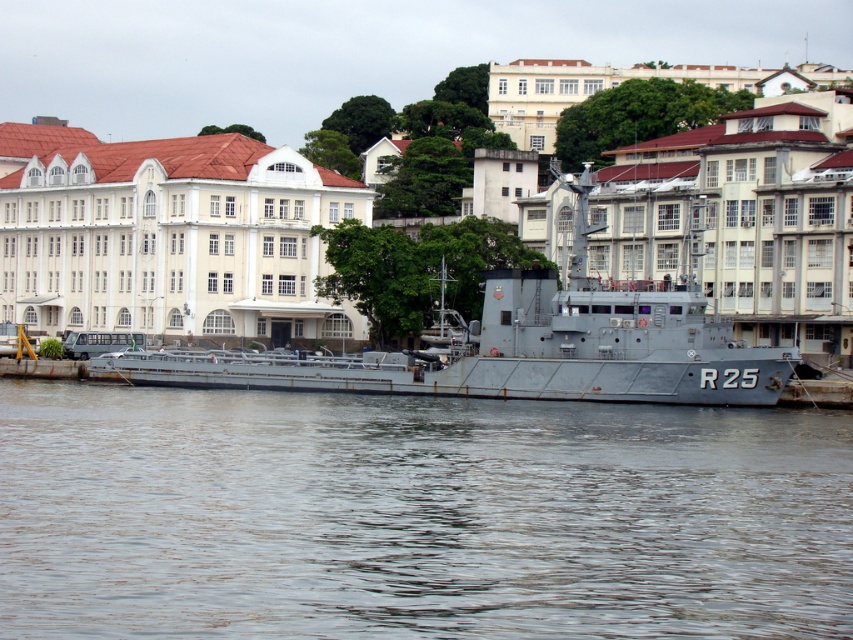
Can you confirm if brown water at lower center is positioned to the right of gray metallic ship at center?

In fact, brown water at lower center is to the left of gray metallic ship at center.

Does brown water at lower center lie in front of gray metallic ship at center?

That is True.

Image resolution: width=853 pixels, height=640 pixels. Describe the element at coordinates (416, 516) in the screenshot. I see `brown water at lower center` at that location.

Locate an element on the screen. This screenshot has width=853, height=640. brown water at lower center is located at coordinates (416, 516).